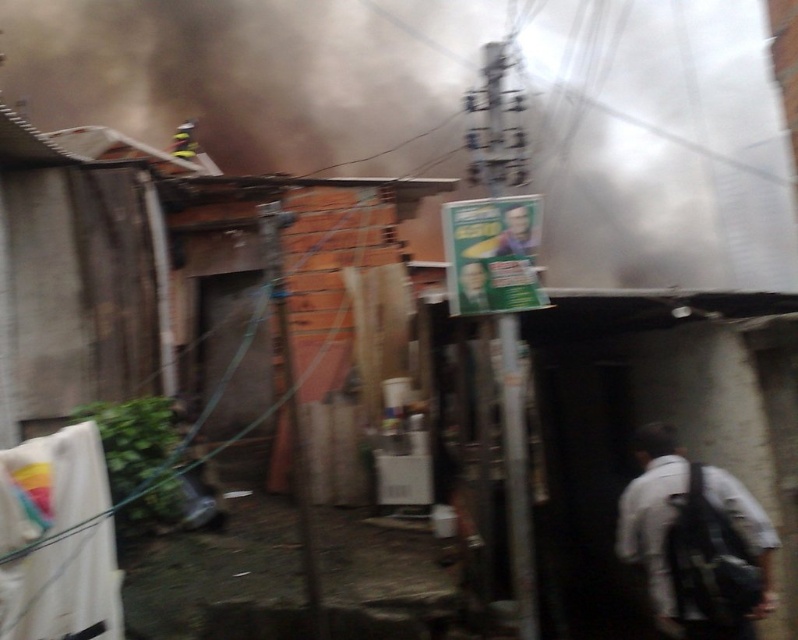
Is black smoke at upper center to the right of white fabric shirt at right from the viewer's perspective?

No, black smoke at upper center is not to the right of white fabric shirt at right.

Which is behind, point (147, 8) or point (664, 438)?

Point (147, 8)

Is point (334, 122) positioned in front of point (755, 545)?

No, (334, 122) is further to viewer.

Locate an element on the screen. The height and width of the screenshot is (640, 798). black smoke at upper center is located at coordinates (259, 76).

Who is more forward, (674, 448) or (58, 515)?

Point (58, 515) is in front.

Can you confirm if white fabric shirt at right is taller than white fabric at left?

Incorrect, white fabric shirt at right's height is not larger of white fabric at left's.

The width and height of the screenshot is (798, 640). Describe the element at coordinates (694, 541) in the screenshot. I see `white fabric shirt at right` at that location.

At what (x,y) coordinates should I click in order to perform the action: click on white fabric shirt at right. Please return your answer as a coordinate pair (x, y). Looking at the image, I should click on (694, 541).

Does black smoke at upper center have a greater width compared to white fabric at left?

Yes.

Is point (660, 113) positioned before point (68, 460)?

No, (660, 113) is behind (68, 460).

Which is in front, point (539, 188) or point (93, 433)?

Point (93, 433) is more forward.

You are a GUI agent. You are given a task and a screenshot of the screen. Output one action in this format:
    pyautogui.click(x=<x>, y=<y>)
    Task: Click on the black smoke at upper center
    The width and height of the screenshot is (798, 640).
    Given the screenshot: What is the action you would take?
    pyautogui.click(x=259, y=76)